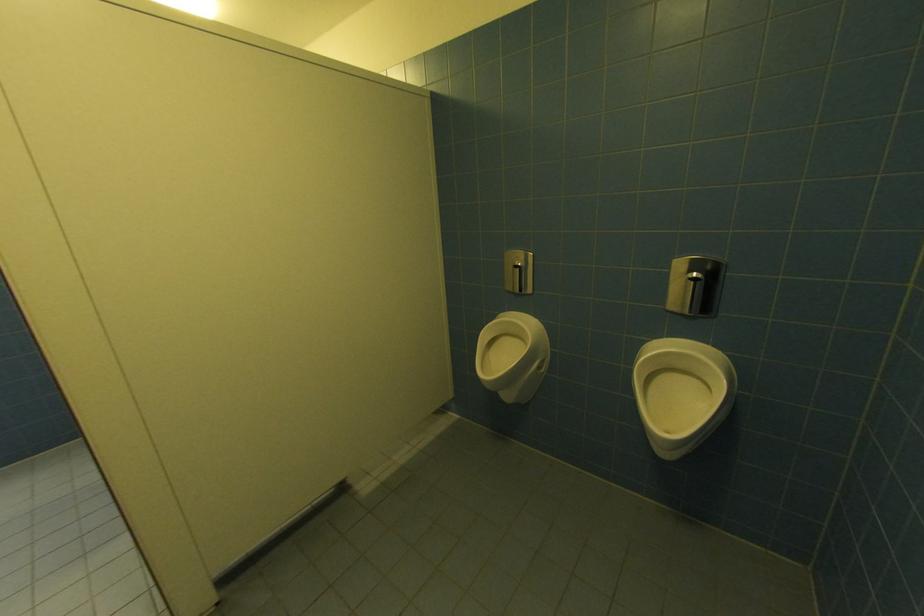
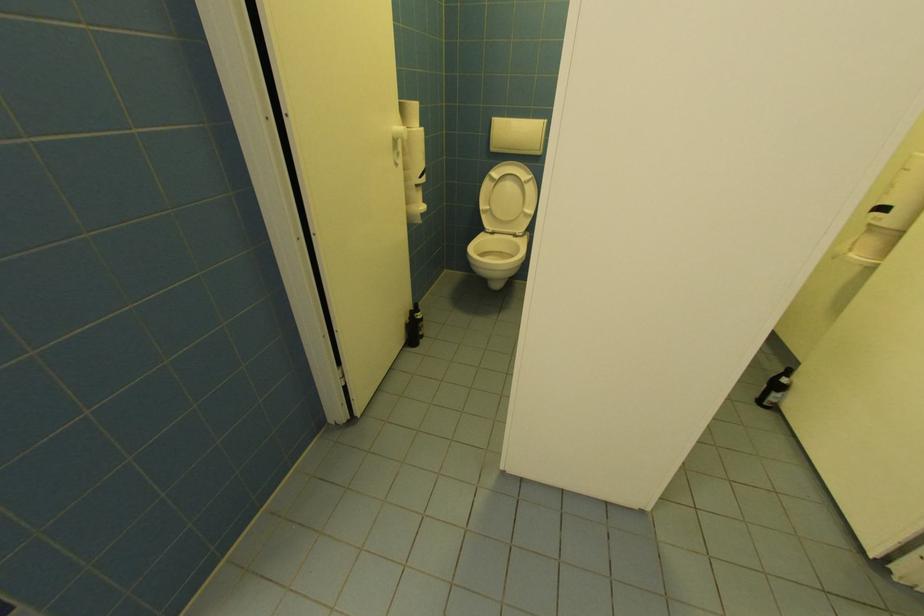
What movement of the cameraman would produce the second image?

The cameraman moved toward left, forward.